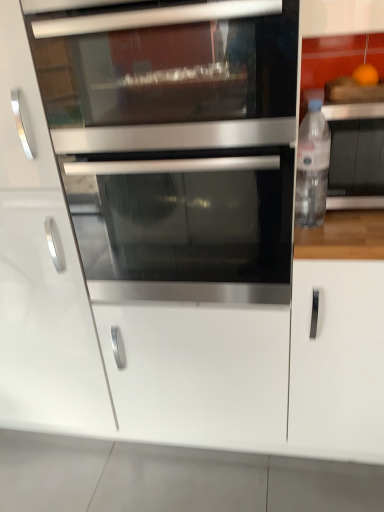
Question: Is point (359, 317) positioned closer to the camera than point (321, 201)?

Choices:
 (A) farther
 (B) closer

Answer: (A)

Question: From the image's perspective, is white matte cabinet handle at right, marked as the second cabinetry in a left-to-right arrangement, above or below clear plastic bottle at right?

Choices:
 (A) above
 (B) below

Answer: (B)

Question: Which of these objects is positioned farthest from the white glossy cabinet at center, the second cabinetry in the right-to-left sequence?

Choices:
 (A) stainless steel oven at center
 (B) clear plastic bottle at right
 (C) clear plastic bottle at right
 (D) stainless steel microwave at center
 (E) white matte drawer at center

Answer: (B)

Question: Which of these objects is positioned farthest from the clear plastic bottle at right?

Choices:
 (A) stainless steel oven at center
 (B) white matte cabinet handle at right, marked as the second cabinetry in a left-to-right arrangement
 (C) clear plastic bottle at right
 (D) white glossy cabinet at center, the second cabinetry in the right-to-left sequence
 (E) white matte drawer at center

Answer: (D)